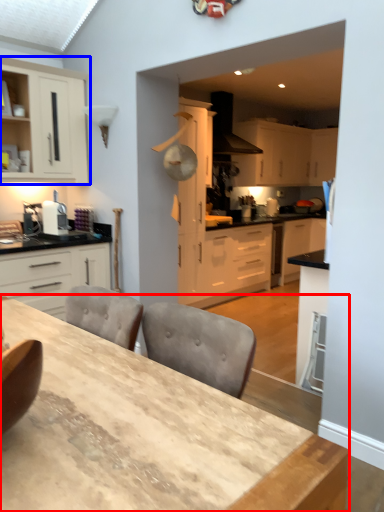
Question: Which object is further to the camera taking this photo, table (highlighted by a red box) or cabinetry (highlighted by a blue box)?

Choices:
 (A) table
 (B) cabinetry

Answer: (B)